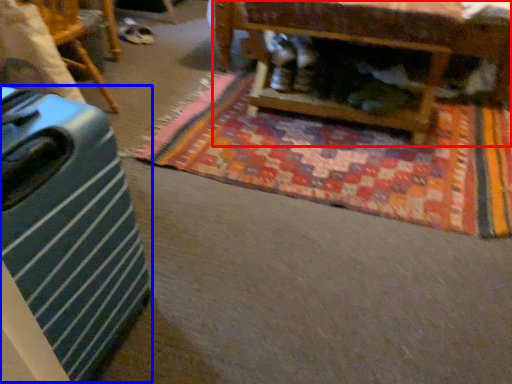
Question: Which object is closer to the camera taking this photo, furniture (highlighted by a red box) or luggage (highlighted by a blue box)?

Choices:
 (A) furniture
 (B) luggage

Answer: (B)